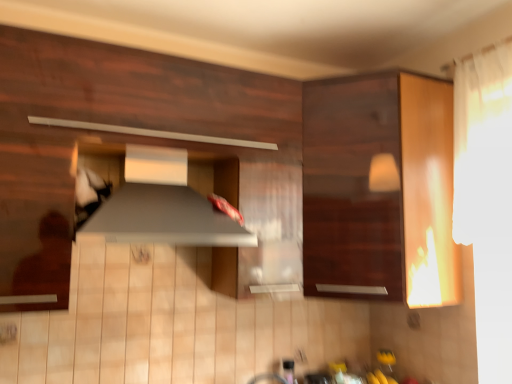
Question: Would you say satin silver exhaust hood at center contains matte wood cabinet at center, placed as the second cabinetry when sorted from right to left?

Choices:
 (A) no
 (B) yes

Answer: (A)

Question: Is satin silver exhaust hood at center positioned in front of matte wood cabinet at center, placed as the second cabinetry when sorted from right to left?

Choices:
 (A) no
 (B) yes

Answer: (A)

Question: Does satin silver exhaust hood at center turn towards matte wood cabinet at center, placed as the second cabinetry when sorted from right to left?

Choices:
 (A) no
 (B) yes

Answer: (B)

Question: Is satin silver exhaust hood at center facing away from matte wood cabinet at center, placed as the second cabinetry when sorted from right to left?

Choices:
 (A) yes
 (B) no

Answer: (A)

Question: Is satin silver exhaust hood at center behind matte wood cabinet at center, marked as the 1th cabinetry in a left-to-right arrangement?

Choices:
 (A) yes
 (B) no

Answer: (A)

Question: From the image's perspective, is satin silver exhaust hood at center over matte wood cabinet at center, placed as the second cabinetry when sorted from right to left?

Choices:
 (A) yes
 (B) no

Answer: (B)

Question: Is wooden cabinet at right, the 1th cabinetry when ordered from right to left, placed right next to satin silver exhaust hood at center?

Choices:
 (A) yes
 (B) no

Answer: (B)

Question: From the image's perspective, is wooden cabinet at right, the 1th cabinetry when ordered from right to left, above satin silver exhaust hood at center?

Choices:
 (A) no
 (B) yes

Answer: (B)

Question: Is wooden cabinet at right, the 1th cabinetry when ordered from right to left, looking in the opposite direction of satin silver exhaust hood at center?

Choices:
 (A) yes
 (B) no

Answer: (B)

Question: Can you confirm if wooden cabinet at right, which ranks as the second cabinetry in left-to-right order, is positioned to the left of satin silver exhaust hood at center?

Choices:
 (A) yes
 (B) no

Answer: (B)

Question: From a real-world perspective, is wooden cabinet at right, which ranks as the second cabinetry in left-to-right order, located beneath satin silver exhaust hood at center?

Choices:
 (A) yes
 (B) no

Answer: (B)

Question: Does wooden cabinet at right, the 1th cabinetry when ordered from right to left, have a larger size compared to satin silver exhaust hood at center?

Choices:
 (A) yes
 (B) no

Answer: (A)

Question: Considering the relative sizes of matte wood cabinet at center, placed as the second cabinetry when sorted from right to left, and wooden cabinet at right, the 1th cabinetry when ordered from right to left, in the image provided, is matte wood cabinet at center, placed as the second cabinetry when sorted from right to left, taller than wooden cabinet at right, the 1th cabinetry when ordered from right to left,?

Choices:
 (A) no
 (B) yes

Answer: (A)